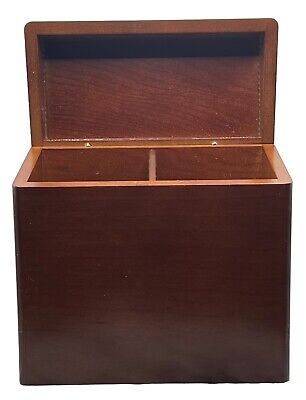
Find the location of a particular element. This screenshot has width=306, height=400. right hinge is located at coordinates (215, 144).